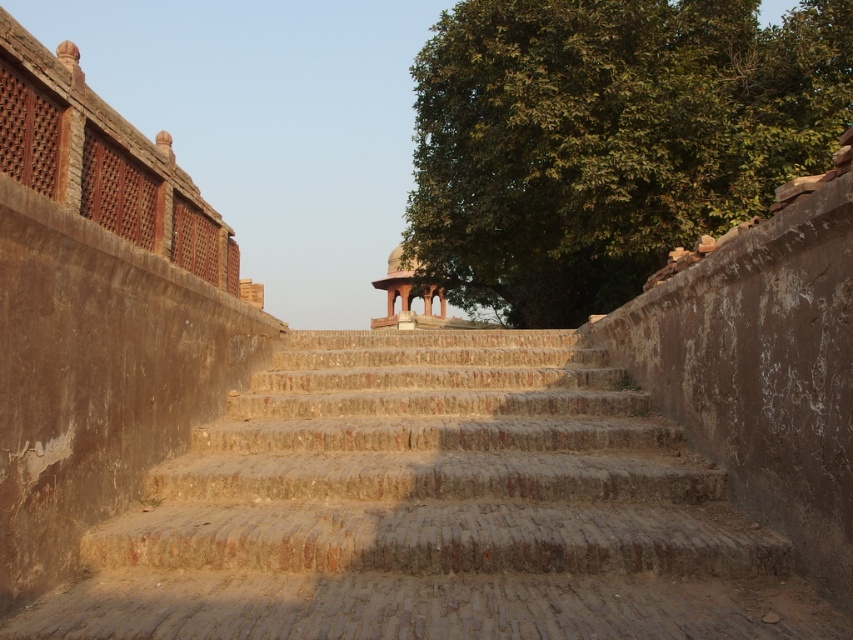
You are standing at the bottom of the brown stone stairs at center and want to reach the matte stone gazebo at center. Which path is narrower between them?

The brown stone stairs at center is thinner than the matte stone gazebo at center, so the path between them is narrower near the stairs.

You are standing at the bottom of the brown stone stairs at center. If you walk straight ahead, will you stay on the stairs or step onto the walls on either side?

Since the brown stone stairs at center are located at point (x=434, y=509), walking straight ahead from the bottom would keep you on the stairs rather than stepping onto the walls on either side.